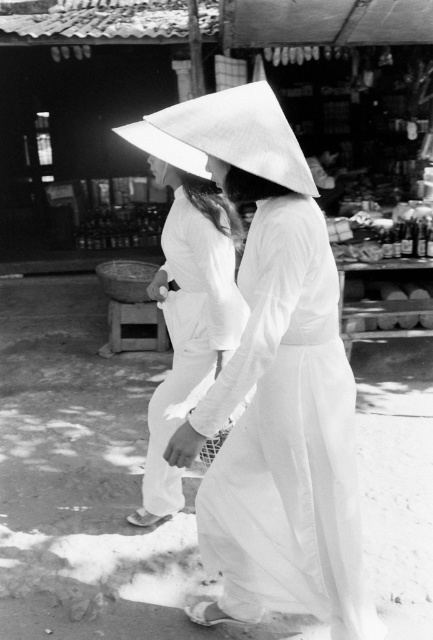
You are a photographer standing in front of the market scene. You want to take a photo focusing on the white cotton dress at center and the white matte ao dai at center. Which one will appear larger in your photo?

The white cotton dress at center will appear larger in the photo because it is closer to the viewer than the white matte ao dai at center.

You are a photographer trying to capture a clear shot of both the white matte ao dai at center and the white paper umbrella at center. Which one is located to the left of the other?

The white matte ao dai at center is positioned on the left side of the white paper umbrella at center.